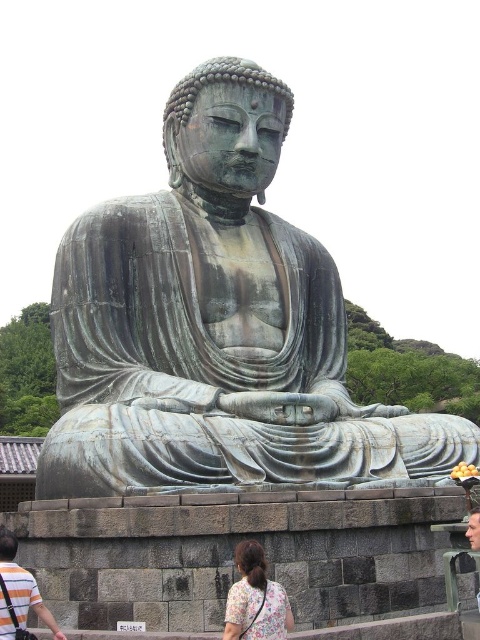
Is floral fabric dress at lower center taller than striped cotton shirt at lower left?

Yes, floral fabric dress at lower center is taller than striped cotton shirt at lower left.

Is floral fabric dress at lower center further to camera compared to striped cotton shirt at lower left?

A: That is False.

Does point (261, 560) come farther from viewer compared to point (4, 625)?

Yes.

Where is `floral fabric dress at lower center`? The image size is (480, 640). floral fabric dress at lower center is located at coordinates (255, 600).

The width and height of the screenshot is (480, 640). What do you see at coordinates (216, 326) in the screenshot?
I see `green patina bronze statue at center` at bounding box center [216, 326].

From the picture: Does green patina bronze statue at center lie behind striped cotton shirt at lower left?

Yes.

Find the location of a particular element. The width and height of the screenshot is (480, 640). green patina bronze statue at center is located at coordinates (216, 326).

Where is `green patina bronze statue at center`? This screenshot has width=480, height=640. green patina bronze statue at center is located at coordinates (216, 326).

Is green patina bronze statue at center bigger than floral fabric dress at lower center?

Correct, green patina bronze statue at center is larger in size than floral fabric dress at lower center.

Which is more to the right, green patina bronze statue at center or floral fabric dress at lower center?

Positioned to the right is green patina bronze statue at center.

Which is behind, point (343, 474) or point (273, 604)?

Positioned behind is point (343, 474).

The height and width of the screenshot is (640, 480). I want to click on green patina bronze statue at center, so click(216, 326).